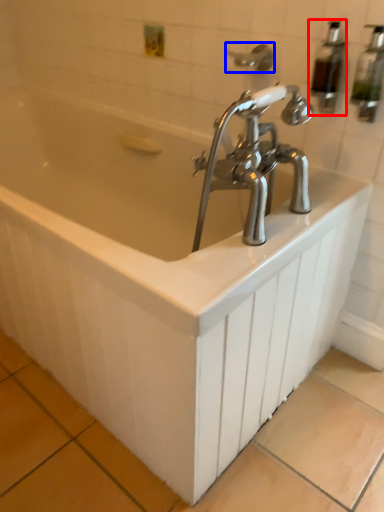
Question: Which of the following is the farthest to the observer, soap dispenser (highlighted by a red box) or shower (highlighted by a blue box)?

Choices:
 (A) soap dispenser
 (B) shower

Answer: (B)